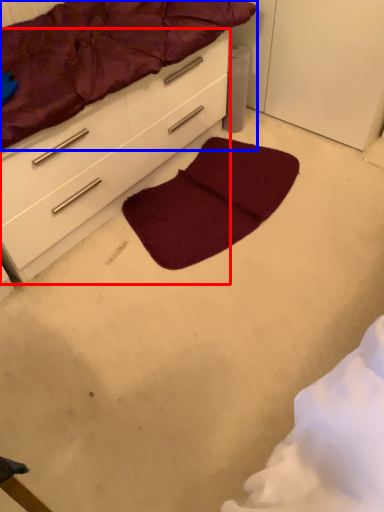
Question: Which object appears closest to the camera in this image, chest of drawers (highlighted by a red box) or mattress (highlighted by a blue box)?

Choices:
 (A) chest of drawers
 (B) mattress

Answer: (B)